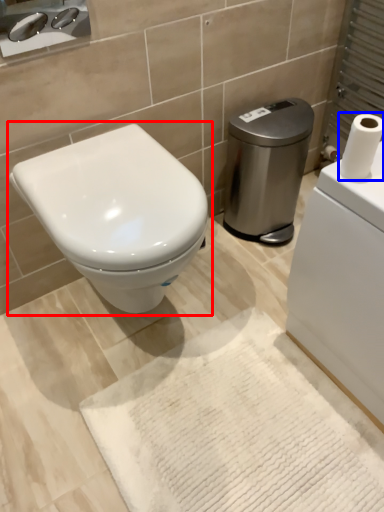
Question: Among these objects, which one is nearest to the camera, toilet (highlighted by a red box) or toilet paper (highlighted by a blue box)?

Choices:
 (A) toilet
 (B) toilet paper

Answer: (B)